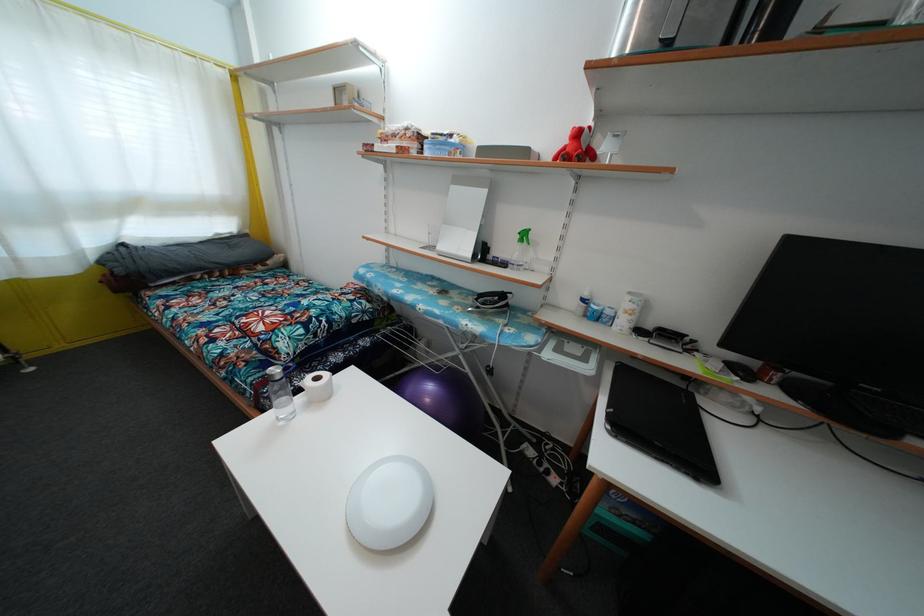
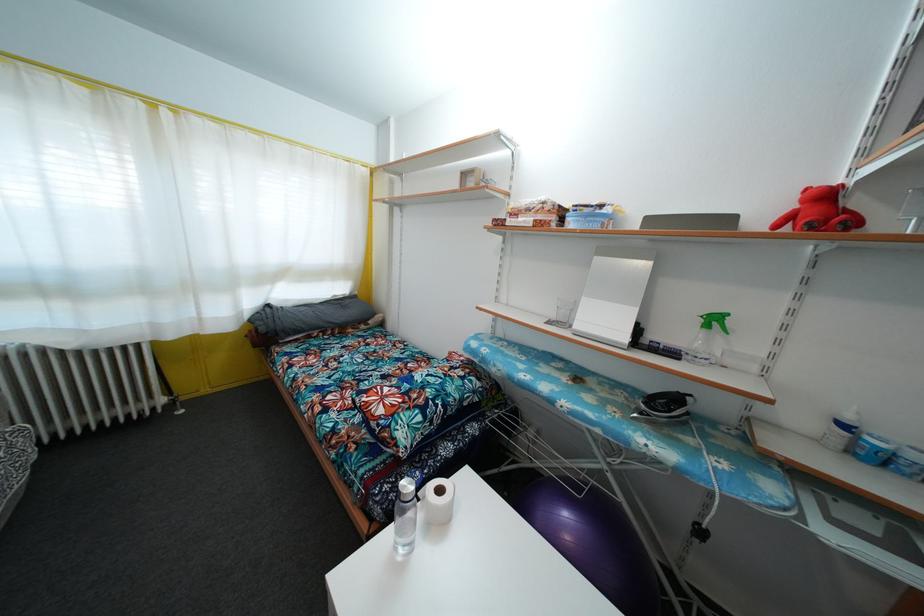
Which direction would the cameraman need to move to produce the second image?

The movement direction of the cameraman is left, forward.